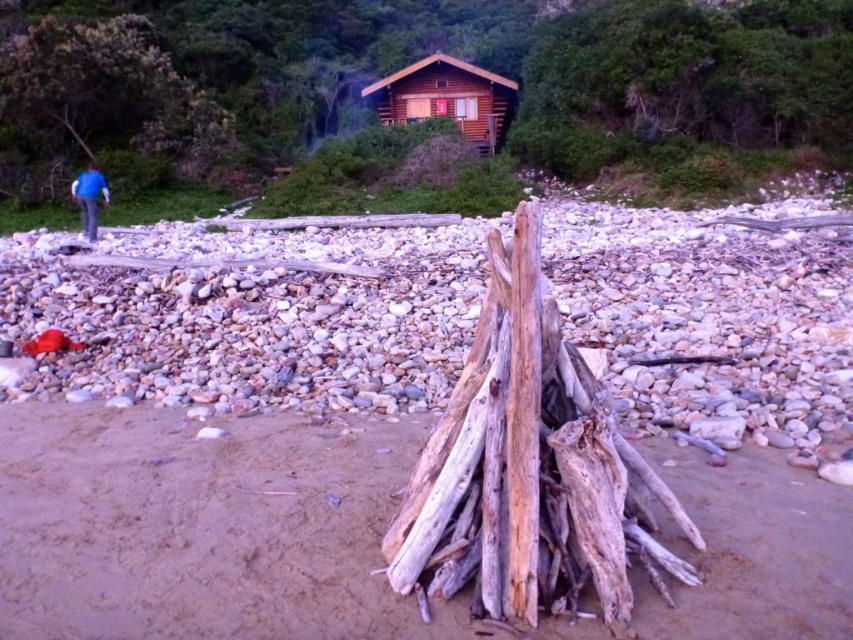
What do you see at coordinates (202, 528) in the screenshot? The image size is (853, 640). I see `smooth tan sand at center` at bounding box center [202, 528].

Can you confirm if smooth tan sand at center is positioned to the left of brown wooden log cabin at upper center?

Yes, smooth tan sand at center is to the left of brown wooden log cabin at upper center.

Does point (68, 577) lie behind point (463, 115)?

No, (68, 577) is in front of (463, 115).

Image resolution: width=853 pixels, height=640 pixels. I want to click on smooth tan sand at center, so click(x=202, y=528).

The image size is (853, 640). I want to click on light brown wood at center, so click(x=529, y=467).

Is light brown wood at center bigger than brown wooden log cabin at upper center?

Actually, light brown wood at center might be smaller than brown wooden log cabin at upper center.

Which is behind, point (553, 449) or point (496, 88)?

The point (496, 88) is behind.

Locate an element on the screen. The image size is (853, 640). light brown wood at center is located at coordinates (529, 467).

Can you confirm if light brown wood at center is positioned above blue fabric jacket at left?

No, light brown wood at center is not above blue fabric jacket at left.

Can you confirm if light brown wood at center is positioned to the right of blue fabric jacket at left?

Yes, light brown wood at center is to the right of blue fabric jacket at left.

Find the location of a particular element. light brown wood at center is located at coordinates (529, 467).